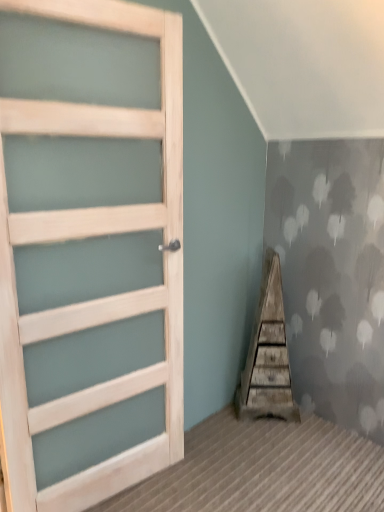
I want to click on free spot to the right of weathered wood stairwell at center, so click(x=319, y=425).